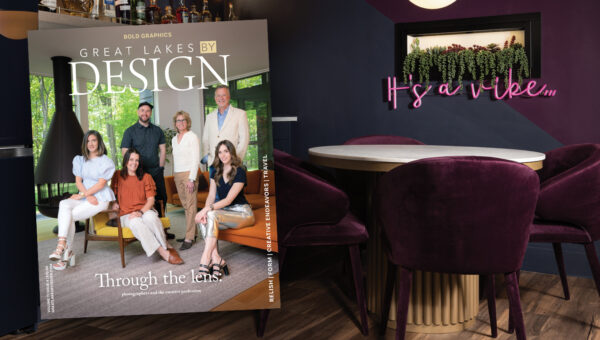
Identify the location of bar. tap(15, 152).